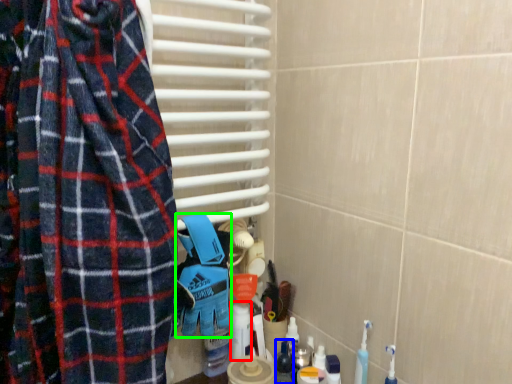
Question: Which object is positioned farthest from cleaning product (highlighted by a red box)? Select from toiletry (highlighted by a blue box) and blanket (highlighted by a green box).

Choices:
 (A) toiletry
 (B) blanket

Answer: (B)